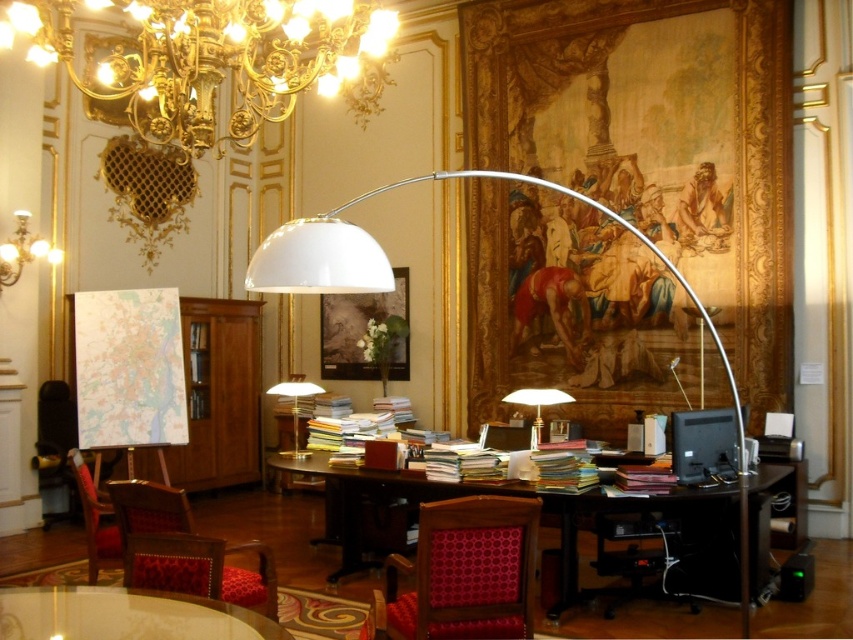
You are standing in the room and want to move from point [366,84] to point [509,552]. Which direction should you move to get closer to the camera?

You should move towards point [509,552] because it is closer to the camera than point [366,84].

You are an office worker who needs to find a document on the desk. You see the yellowish paper stack at right and the matte gold chandelier at upper left. Which object is closer to you?

The yellowish paper stack at right is closer to you because it is positioned under the matte gold chandelier at upper left, indicating it is lower and nearer in the scene.

You are standing in the room and want to locate the gold metallic chandelier at upper left. According to the coordinates given, where should you look? Please provide the coordinates in the format of a point like this example format of point format is 0.000 to 1.000 on both x and y axes, representing the position on the image. The origin is at the bottom left corner of the image. The x increases to the right and y increases upward. The example format is point format is 0.000,0.000 to 1.000,1.000. Please just

The gold metallic chandelier at upper left is located at point coordinates of (219, 60).